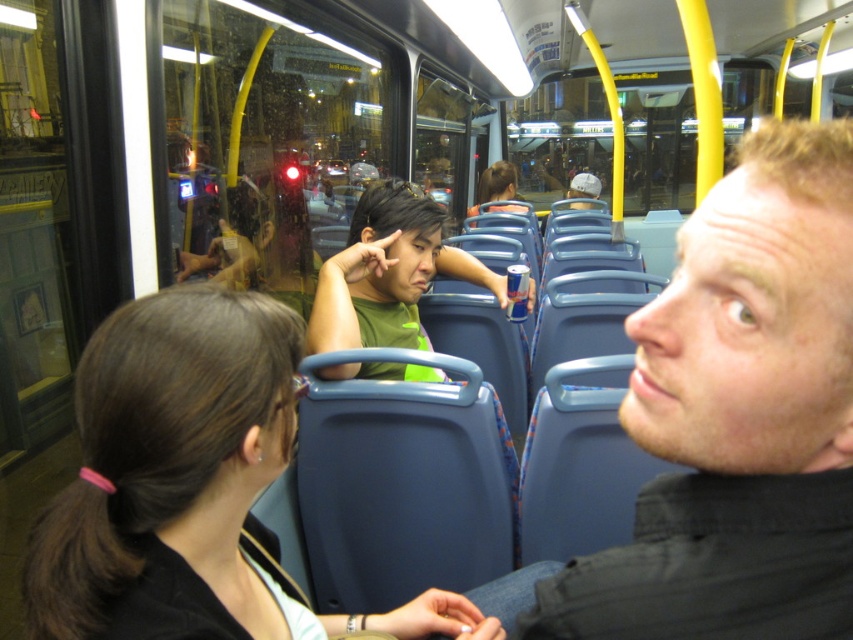
You are a passenger on the bus and want to know which of the two points, point (676, 340) or point (74, 492), is closer to you. Based on the scene description, can you determine which point is nearer?

Point (676, 340) is closer to the camera than point (74, 492), so it is nearer to you.

What is the color of the shirt of the person located at point (738, 417)?

The point (738, 417) is on smooth black shirt at center, so the color is black.